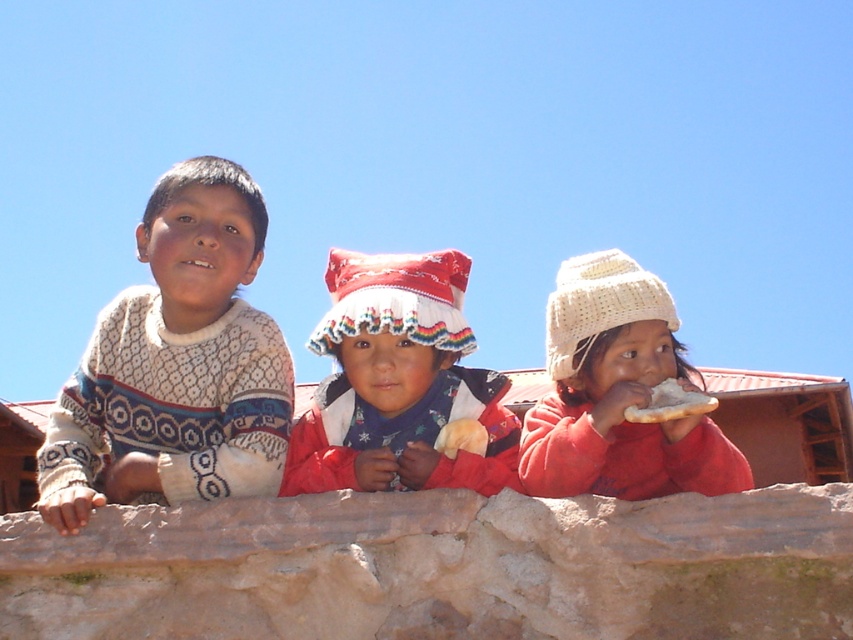
You are a photographer trying to capture a photo of the white knitted sweater at left and the white bread at center. Which object should you focus on first if you want to ensure both are in the frame without moving the camera?

You should focus on the white knitted sweater at left first because it is much taller than the white bread at center, so adjusting the camera angle to include its height will naturally include the shorter white bread at center in the frame.

From the picture: You are a photographer trying to capture a clear shot of both the brown rough stone at center and the red and white knitted hat at center. Since the stone is under the hat, will you need to adjust your camera angle to see both objects in the frame?

The brown rough stone at center is positioned under the red and white knitted hat at center, so you will need to adjust your camera angle to see both objects in the frame.

You are a drone operator trying to take a photo of the red and white knitted hat at center and the brown rough stone at center. The minimum distance between the two objects must be maintained in the photo. What is the minimum distance you should set between the two objects in the photo to ensure both are visible?

The minimum distance you should set between the brown rough stone at center and the red and white knitted hat at center in the photo is 6.18 meters to ensure both are visible while maintaining their actual distance.